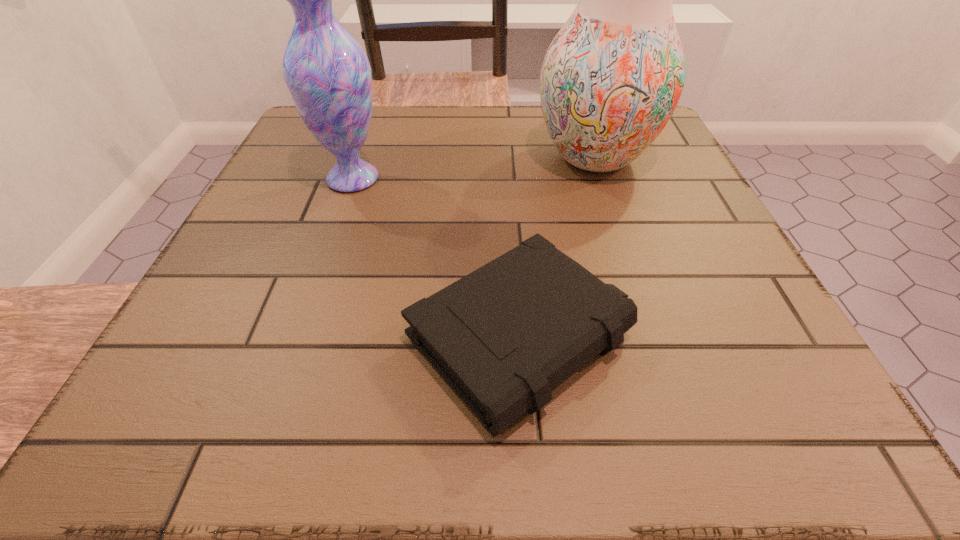
The height and width of the screenshot is (540, 960). Find the location of `free space in the image that satisfies the following two spatial constraints: 1. on the back side of the right vase; 2. on the left side of the Bible`. free space in the image that satisfies the following two spatial constraints: 1. on the back side of the right vase; 2. on the left side of the Bible is located at coordinates (507, 158).

The height and width of the screenshot is (540, 960). What are the coordinates of `free space that satisfies the following two spatial constraints: 1. on the back side of the right vase; 2. on the right side of the leftmost object` in the screenshot? It's located at pos(360,158).

Where is `free space that satisfies the following two spatial constraints: 1. on the front side of the left vase; 2. on the left side of the shortest object`? free space that satisfies the following two spatial constraints: 1. on the front side of the left vase; 2. on the left side of the shortest object is located at coordinates (297, 337).

The height and width of the screenshot is (540, 960). In order to click on blank space that satisfies the following two spatial constraints: 1. on the back side of the left vase; 2. on the left side of the right vase in this screenshot , I will do `click(360, 158)`.

At what (x,y) coordinates should I click in order to perform the action: click on free location that satisfies the following two spatial constraints: 1. on the back side of the leftmost object; 2. on the left side of the right vase. Please return your answer as a coordinate pair (x, y). The width and height of the screenshot is (960, 540). Looking at the image, I should click on (360, 158).